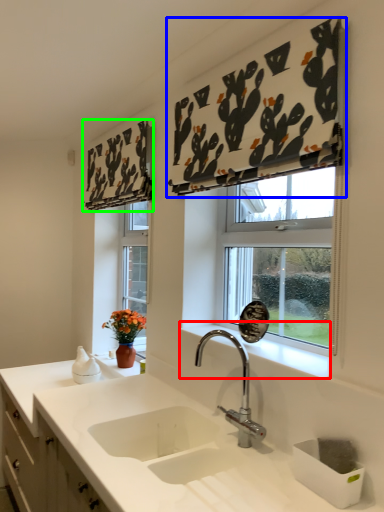
Question: Which object is the closest to the window sill (highlighted by a red box)? Choose among these: curtain (highlighted by a blue box) or curtain (highlighted by a green box).

Choices:
 (A) curtain
 (B) curtain

Answer: (A)